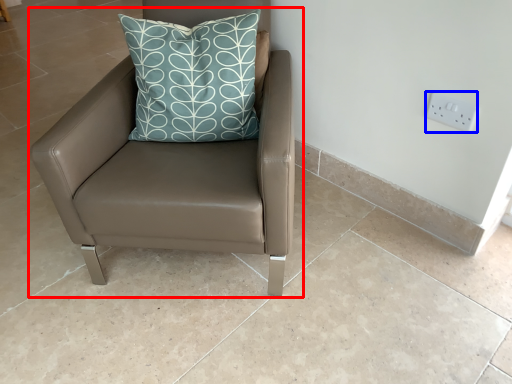
Question: Which object appears farthest to the camera in this image, chair (highlighted by a red box) or electric outlet (highlighted by a blue box)?

Choices:
 (A) chair
 (B) electric outlet

Answer: (B)